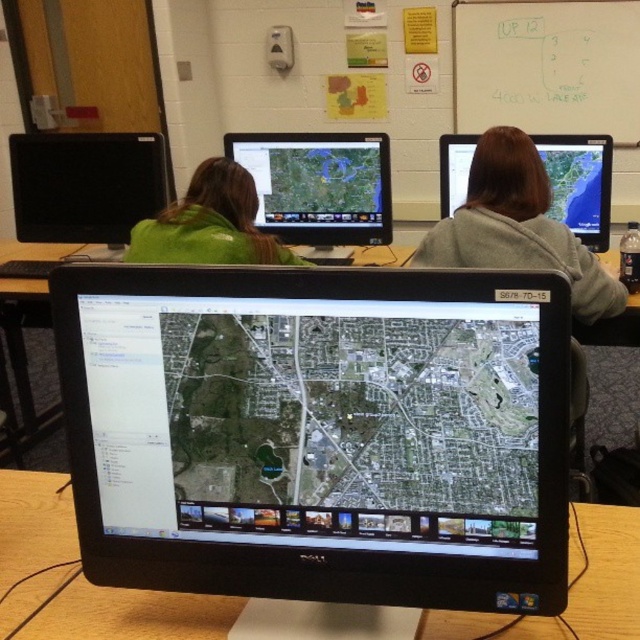
Question: Does black glossy monitor at center come in front of matte black monitor at center?

Choices:
 (A) no
 (B) yes

Answer: (B)

Question: Which object is farther from the camera taking this photo?

Choices:
 (A) black glossy monitor at left
 (B) green matte jacket at upper left
 (C) black glossy monitor at center

Answer: (A)

Question: Can you confirm if gray fleece jacket at upper right is positioned above black glossy monitor at left?

Choices:
 (A) yes
 (B) no

Answer: (B)

Question: Is wooden table at center above gray fleece jacket at upper right?

Choices:
 (A) no
 (B) yes

Answer: (A)

Question: Which point is farther from the camera taking this photo?

Choices:
 (A) (593, 204)
 (B) (177, 259)

Answer: (A)

Question: Which point is farther from the camera taking this photo?

Choices:
 (A) (60, 182)
 (B) (572, 147)

Answer: (A)